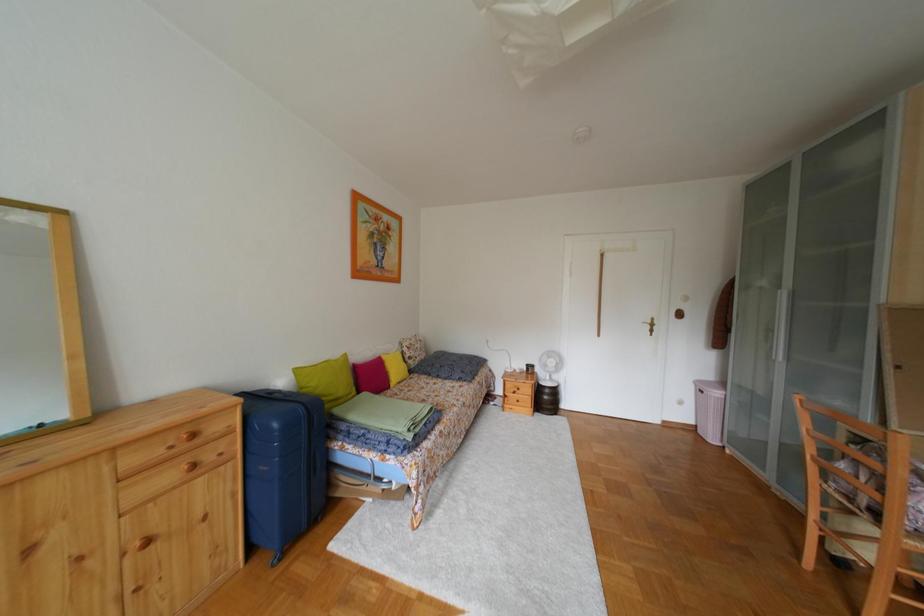
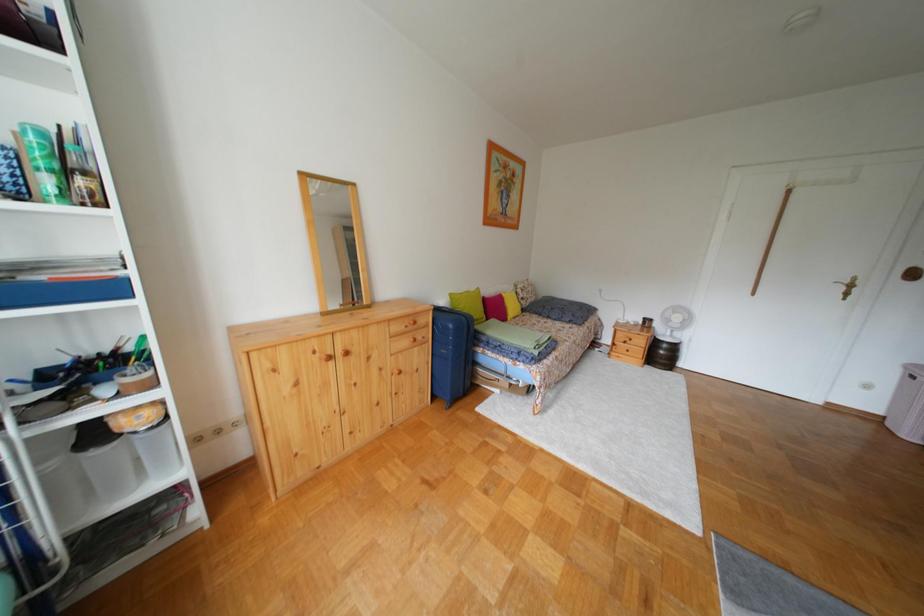
Question: The camera is either moving clockwise (left) or counter-clockwise (right) around the object. The first image is from the beginning of the video and the second image is from the end. Is the camera moving left or right when shooting the video?

Choices:
 (A) Left
 (B) Right

Answer: (B)